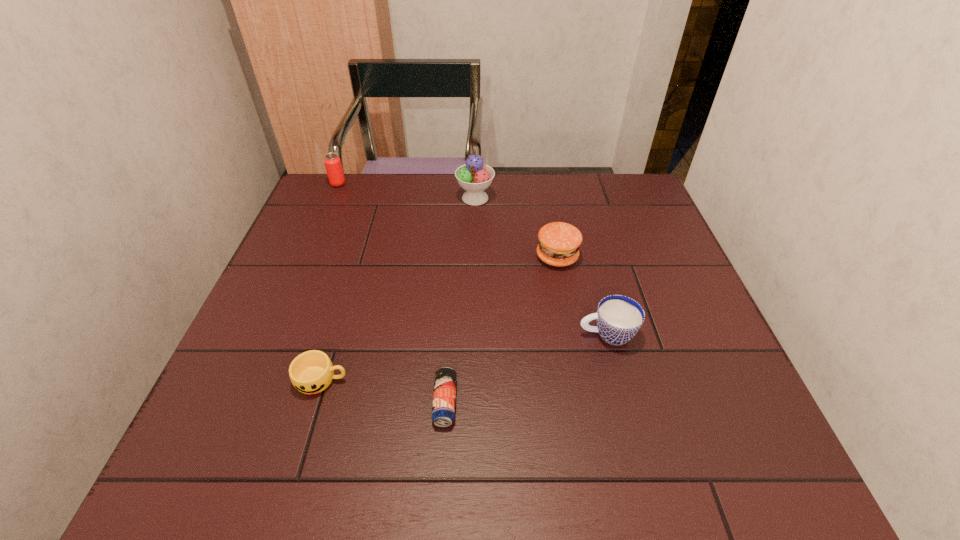
Image resolution: width=960 pixels, height=540 pixels. I want to click on beer can that is at the left edge, so point(332,162).

I want to click on cup that is at the left edge, so click(311, 372).

At what (x,y) coordinates should I click in order to perform the action: click on object present at the far left corner. Please return your answer as a coordinate pair (x, y). This screenshot has height=540, width=960. Looking at the image, I should click on (332, 162).

Locate an element on the screen. free space at the far edge is located at coordinates (481, 211).

Where is `blank area at the near edge`? The height and width of the screenshot is (540, 960). blank area at the near edge is located at coordinates (453, 457).

Where is `vacant space at the left edge of the desktop`? vacant space at the left edge of the desktop is located at coordinates (315, 280).

At what (x,y) coordinates should I click in order to perform the action: click on free point at the right edge. Please return your answer as a coordinate pair (x, y). Looking at the image, I should click on (699, 312).

I want to click on free space between the shorter beer can and the icecream, so click(460, 300).

The image size is (960, 540). Identify the location of free area in between the right cup and the icecream. (541, 266).

You are a GUI agent. You are given a task and a screenshot of the screen. Output one action in this format:
    pyautogui.click(x=<x>, y=<y>)
    Task: Click on the unoccupied position between the nearer beer can and the third nearest object
    This screenshot has width=960, height=540.
    Given the screenshot: What is the action you would take?
    pyautogui.click(x=526, y=368)